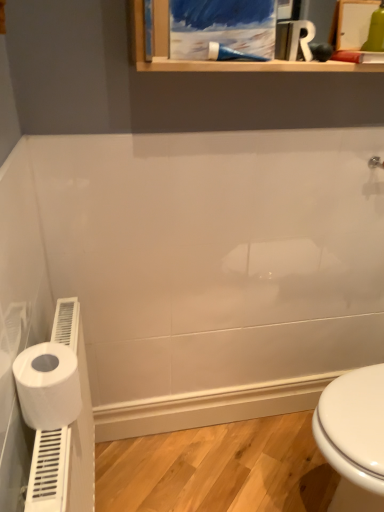
Question: Does white matte toilet paper at left contain white plastic toilet paper holder at lower left?

Choices:
 (A) yes
 (B) no

Answer: (B)

Question: Is white matte toilet paper at left positioned in front of white plastic toilet paper holder at lower left?

Choices:
 (A) no
 (B) yes

Answer: (A)

Question: Are white matte toilet paper at left and white plastic toilet paper holder at lower left making contact?

Choices:
 (A) yes
 (B) no

Answer: (B)

Question: Is white matte toilet paper at left bigger than white plastic toilet paper holder at lower left?

Choices:
 (A) yes
 (B) no

Answer: (B)

Question: Could you tell me if white matte toilet paper at left is facing white plastic toilet paper holder at lower left?

Choices:
 (A) no
 (B) yes

Answer: (A)

Question: Does white matte toilet paper at left have a lesser width compared to white plastic toilet paper holder at lower left?

Choices:
 (A) yes
 (B) no

Answer: (B)

Question: Is white plastic toilet paper holder at lower left bigger than blue plastic shower at upper center?

Choices:
 (A) yes
 (B) no

Answer: (A)

Question: Does white plastic toilet paper holder at lower left have a greater height compared to blue plastic shower at upper center?

Choices:
 (A) no
 (B) yes

Answer: (B)

Question: Could you tell me if white plastic toilet paper holder at lower left is facing blue plastic shower at upper center?

Choices:
 (A) yes
 (B) no

Answer: (B)

Question: Does white plastic toilet paper holder at lower left have a smaller size compared to blue plastic shower at upper center?

Choices:
 (A) yes
 (B) no

Answer: (B)

Question: Is white plastic toilet paper holder at lower left facing away from blue plastic shower at upper center?

Choices:
 (A) no
 (B) yes

Answer: (A)

Question: Does white plastic toilet paper holder at lower left appear on the left side of blue plastic shower at upper center?

Choices:
 (A) no
 (B) yes

Answer: (B)

Question: Is white matte toilet paper at left at the right side of blue plastic shower at upper center?

Choices:
 (A) no
 (B) yes

Answer: (A)